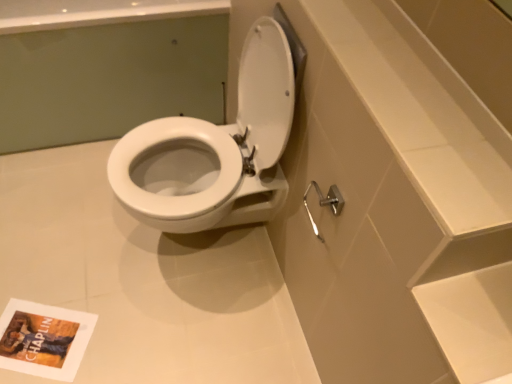
What are the coordinates of `vacant space underneath matte paper book cover at lower left (from a real-world perspective)` in the screenshot? It's located at (37, 339).